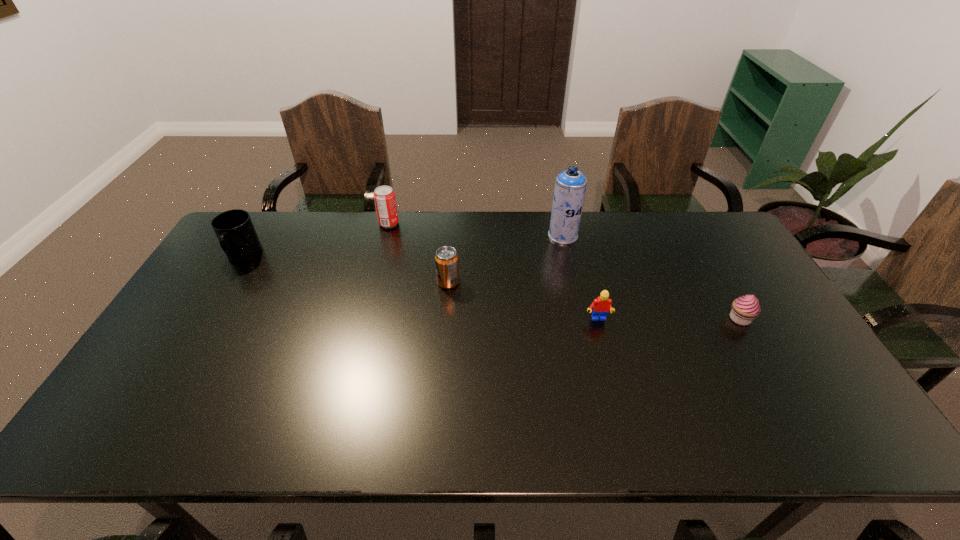
The image size is (960, 540). In the image, there is a desktop. Identify the location of free space at the far edge. (621, 225).

In the image, there is a desktop. At what (x,y) coordinates should I click in order to perform the action: click on vacant space at the near edge. Please return your answer as a coordinate pair (x, y). The image size is (960, 540). Looking at the image, I should click on (558, 414).

You are a GUI agent. You are given a task and a screenshot of the screen. Output one action in this format:
    pyautogui.click(x=<x>, y=<y>)
    Task: Click on the vacant region at the left edge
    
    Given the screenshot: What is the action you would take?
    pyautogui.click(x=183, y=323)

Find the location of a particular element. The image size is (960, 540). vacant space at the right edge of the desktop is located at coordinates (708, 272).

Image resolution: width=960 pixels, height=540 pixels. I want to click on vacant space at the near left corner of the desktop, so click(117, 428).

At what (x,y) coordinates should I click in order to perform the action: click on free space between the mug and the cupcake. Please return your answer as a coordinate pair (x, y). Looking at the image, I should click on (492, 287).

Find the location of `vacant area that lies between the fourth farthest object and the aerosol can`. vacant area that lies between the fourth farthest object and the aerosol can is located at coordinates (506, 259).

You are a GUI agent. You are given a task and a screenshot of the screen. Output one action in this format:
    pyautogui.click(x=<x>, y=<y>)
    Task: Click on the empty space between the Lego and the nearer soda can
    
    Given the screenshot: What is the action you would take?
    pyautogui.click(x=523, y=301)

Locate an element on the screen. Image resolution: width=960 pixels, height=540 pixels. empty location between the Lego and the rightmost object is located at coordinates (668, 319).

Image resolution: width=960 pixels, height=540 pixels. What are the coordinates of `vacant area between the cupcake and the farther soda can` in the screenshot? It's located at (564, 271).